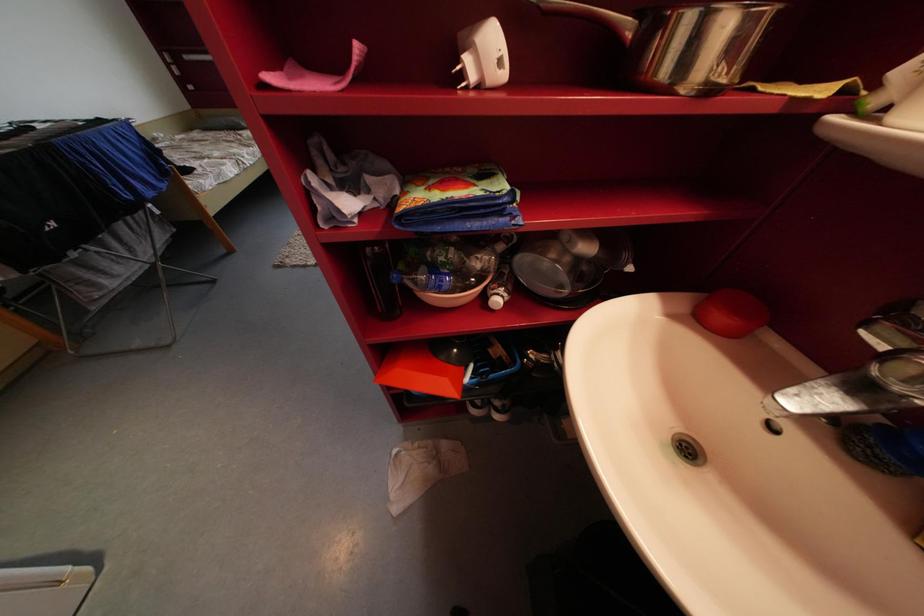
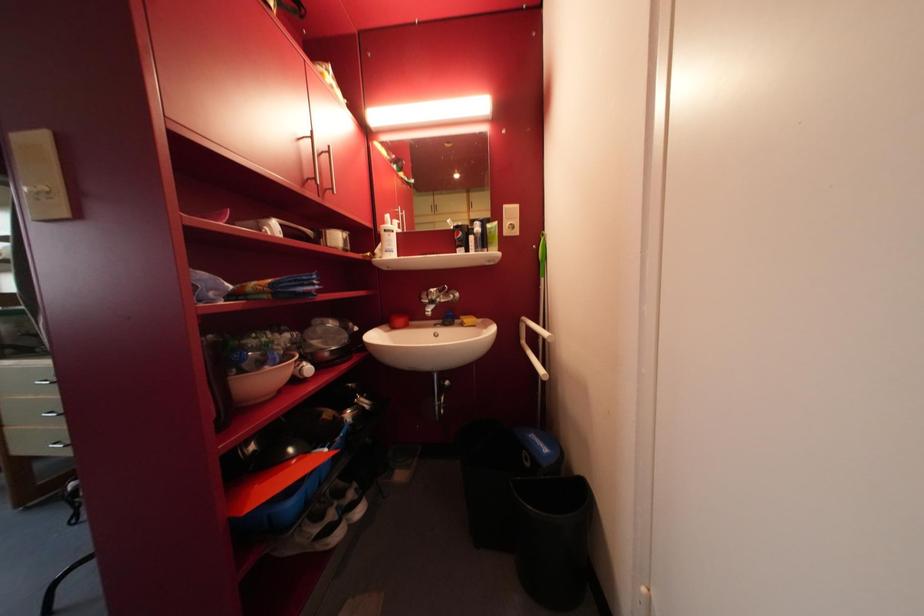
Question: The camera is either moving clockwise (left) or counter-clockwise (right) around the object. The first image is from the beginning of the video and the second image is from the end. Is the camera moving left or right when shooting the video?

Choices:
 (A) Left
 (B) Right

Answer: (A)